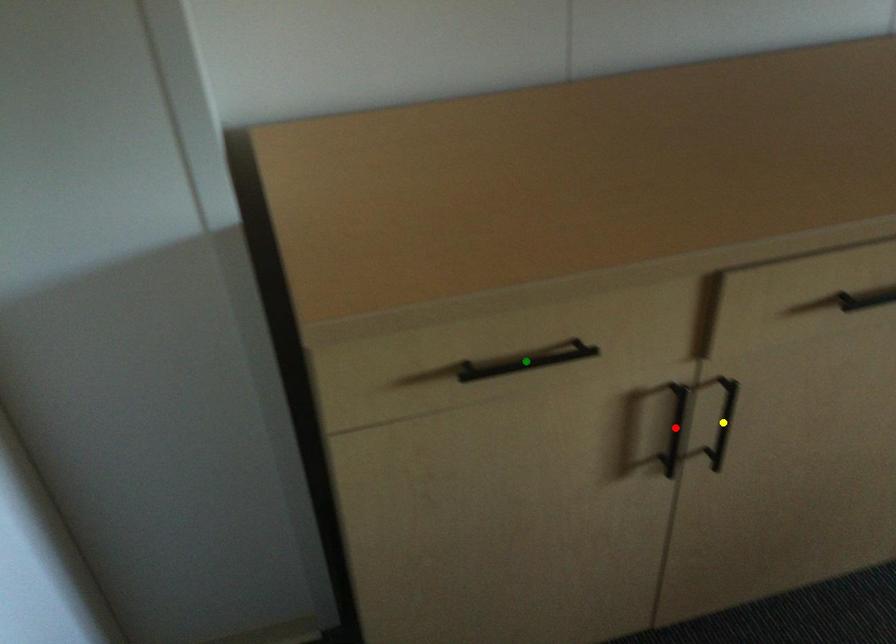
Order these from nearest to farthest:
red point, yellow point, green point

1. green point
2. red point
3. yellow point